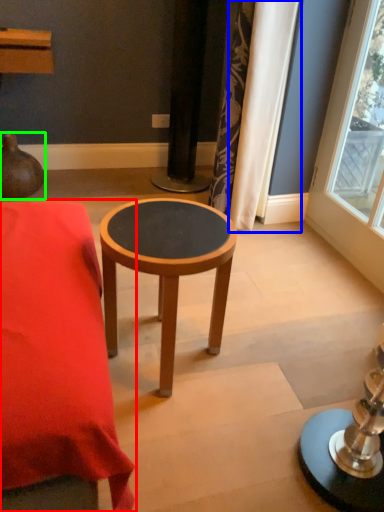
Question: Which is farther away from table (highlighted by a red box)? curtain (highlighted by a blue box) or vase (highlighted by a green box)?

Choices:
 (A) curtain
 (B) vase

Answer: (B)